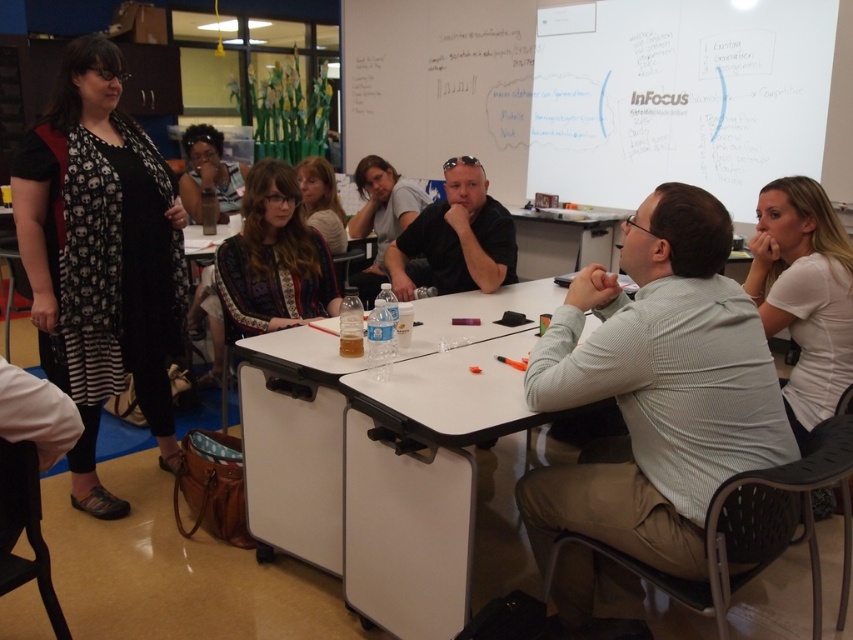
Which of these two, whiteboard at upper center or matte black glasses at upper center, stands taller?

With more height is whiteboard at upper center.

Who is positioned more to the right, whiteboard at upper center or matte black glasses at upper center?

whiteboard at upper center is more to the right.

I want to click on whiteboard at upper center, so click(440, 83).

The image size is (853, 640). I want to click on whiteboard at upper center, so click(440, 83).

Does point (248, 424) lie in front of point (430, 99)?

Yes, it is in front of point (430, 99).

Identify the location of white plastic table at center. [399, 458].

Is point (427, 568) less distant than point (523, 88)?

That is True.

Find the location of a particular element. white plastic table at center is located at coordinates (399, 458).

What do you see at coordinates (102, 257) in the screenshot?
I see `black printed dress at left` at bounding box center [102, 257].

Does black printed dress at left appear under patterned fabric shirt at center?

Correct, black printed dress at left is located below patterned fabric shirt at center.

Where is `black printed dress at left`? The width and height of the screenshot is (853, 640). black printed dress at left is located at coordinates (102, 257).